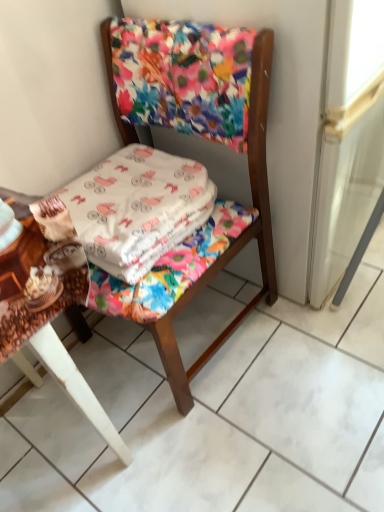
You are a GUI agent. You are given a task and a screenshot of the screen. Output one action in this format:
    pyautogui.click(x=<x>, y=<y>)
    Task: Click on the empty space that is ontop of white cotton blanket at center (from a real-world perspective)
    
    Given the screenshot: What is the action you would take?
    pyautogui.click(x=103, y=183)